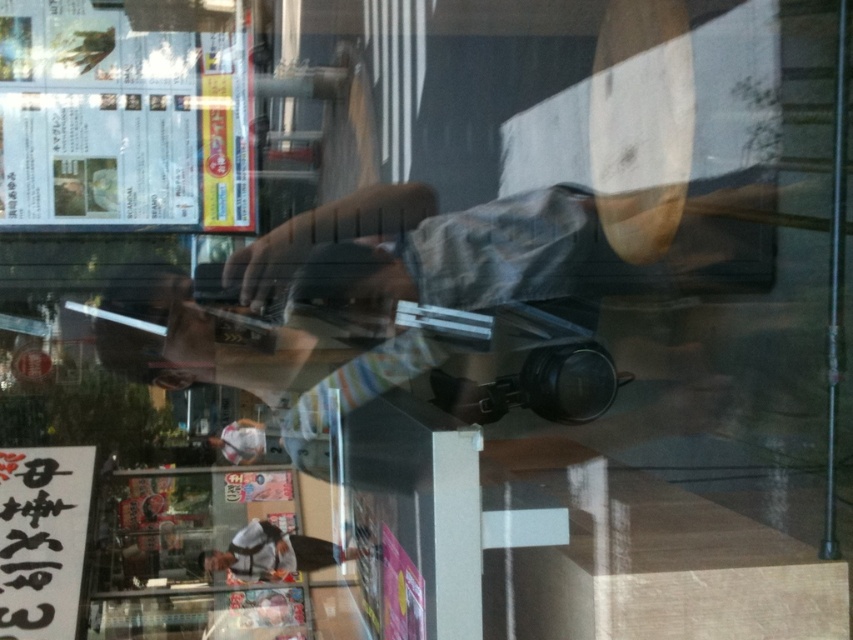
You are a delivery person who needs to place a small package on the table. The gray fabric shirt at center and the white plastic bag at lower center are on the table. Can you place the package between them without moving either object?

The gray fabric shirt at center is in front of the white plastic bag at lower center, so there is space between them where the package can be placed without moving either object.